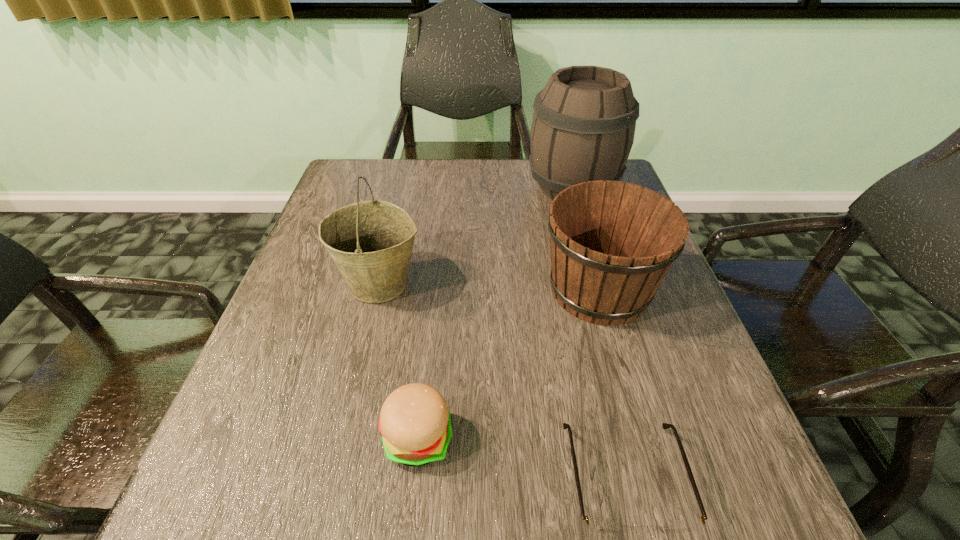
Locate an element on the screen. the farthest wine bucket is located at coordinates (583, 127).

Locate an element on the screen. the second shortest wine bucket is located at coordinates (371, 242).

Locate an element on the screen. Image resolution: width=960 pixels, height=540 pixels. the fourth shortest object is located at coordinates (371, 242).

In order to click on the shortest wine bucket in this screenshot , I will do `click(612, 243)`.

In order to click on the second shortest object in this screenshot , I will do `click(415, 424)`.

Locate an element on the screen. This screenshot has height=540, width=960. free space located 0.050m on the front of the farthest wine bucket is located at coordinates (584, 225).

This screenshot has height=540, width=960. I want to click on free space located on the right of the leftmost wine bucket, so click(x=562, y=283).

At what (x,y) coordinates should I click in order to perform the action: click on free spot located on the back of the shortest wine bucket. Please return your answer as a coordinate pair (x, y). The height and width of the screenshot is (540, 960). Looking at the image, I should click on (585, 237).

Where is `free location located 0.200m on the right of the hamburger`? Image resolution: width=960 pixels, height=540 pixels. free location located 0.200m on the right of the hamburger is located at coordinates (578, 438).

I want to click on object present at the far edge, so click(x=583, y=127).